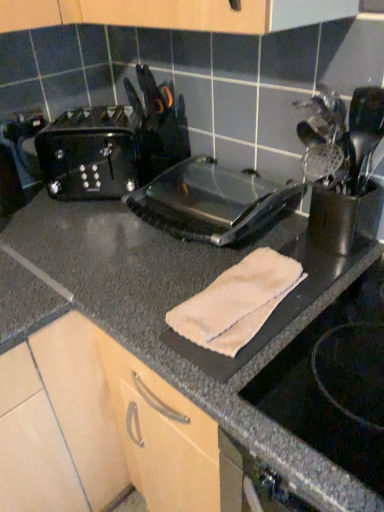
Question: Is point (344, 177) positioned closer to the camera than point (135, 129)?

Choices:
 (A) closer
 (B) farther

Answer: (A)

Question: From their relative heights in the image, would you say satin silver utensil holder at right is taller or shorter than black plastic toaster at left?

Choices:
 (A) tall
 (B) short

Answer: (A)

Question: Estimate the real-world distances between objects in this image. Which object is farther from the black plastic toaster at left?

Choices:
 (A) granite black countertop at center
 (B) transparent plastic toaster at center
 (C) satin silver utensil holder at right
 (D) beige cotton towel at center
 (E) white fabric at lower right

Answer: (E)

Question: Considering the real-world distances, which object is closest to the satin silver utensil holder at right?

Choices:
 (A) granite black countertop at center
 (B) beige cotton towel at center
 (C) white fabric at lower right
 (D) black plastic toaster at left
 (E) transparent plastic toaster at center

Answer: (E)